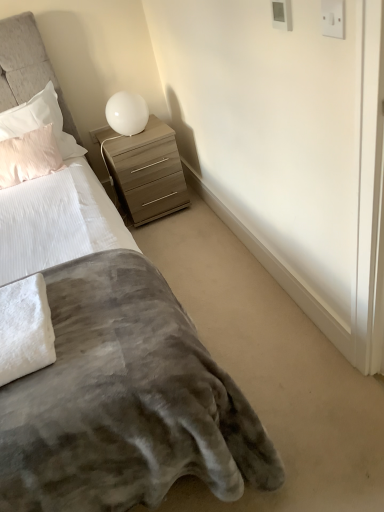
Question: Is white plastic electric outlet at upper right, positioned as the first electric outlet in front-to-back order, in front of white plastic electric outlet at upper right, the 2th electric outlet viewed from the right?

Choices:
 (A) no
 (B) yes

Answer: (B)

Question: Considering the relative sizes of white plastic electric outlet at upper right, which is the second electric outlet in back-to-front order, and white plastic electric outlet at upper right, placed as the first electric outlet when sorted from back to front, in the image provided, is white plastic electric outlet at upper right, which is the second electric outlet in back-to-front order, thinner than white plastic electric outlet at upper right, placed as the first electric outlet when sorted from back to front,?

Choices:
 (A) no
 (B) yes

Answer: (B)

Question: Does white plastic electric outlet at upper right, which is the second electric outlet in back-to-front order, turn towards white plastic electric outlet at upper right, marked as the first electric outlet in a top-to-bottom arrangement?

Choices:
 (A) yes
 (B) no

Answer: (B)

Question: From a real-world perspective, is white plastic electric outlet at upper right, the first electric outlet viewed from the right, over white plastic electric outlet at upper right, the 2th electric outlet viewed from the right?

Choices:
 (A) no
 (B) yes

Answer: (B)

Question: Does white plastic electric outlet at upper right, which is the first electric outlet in bottom-to-top order, contain white plastic electric outlet at upper right, marked as the first electric outlet in a top-to-bottom arrangement?

Choices:
 (A) no
 (B) yes

Answer: (A)

Question: Is white plastic electric outlet at upper right, which is the second electric outlet in back-to-front order, smaller than white plastic electric outlet at upper right, placed as the first electric outlet when sorted from back to front?

Choices:
 (A) yes
 (B) no

Answer: (A)

Question: Is white glossy table lamp at upper right completely or partially inside white fluffy towel at lower left?

Choices:
 (A) yes
 (B) no

Answer: (B)

Question: From the image's perspective, does white fluffy towel at lower left appear higher than white glossy table lamp at upper right?

Choices:
 (A) no
 (B) yes

Answer: (A)

Question: Is the position of white fluffy towel at lower left more distant than that of white glossy table lamp at upper right?

Choices:
 (A) no
 (B) yes

Answer: (A)

Question: Considering the relative sizes of white fluffy towel at lower left and white glossy table lamp at upper right in the image provided, is white fluffy towel at lower left taller than white glossy table lamp at upper right?

Choices:
 (A) no
 (B) yes

Answer: (A)

Question: Would you consider white fluffy towel at lower left to be distant from white glossy table lamp at upper right?

Choices:
 (A) yes
 (B) no

Answer: (A)

Question: Considering the relative sizes of white fluffy towel at lower left and white glossy table lamp at upper right in the image provided, is white fluffy towel at lower left thinner than white glossy table lamp at upper right?

Choices:
 (A) no
 (B) yes

Answer: (A)

Question: Is velvet gray blanket at lower left wider than white plastic electric outlet at upper right, the first electric outlet viewed from the right?

Choices:
 (A) no
 (B) yes

Answer: (B)